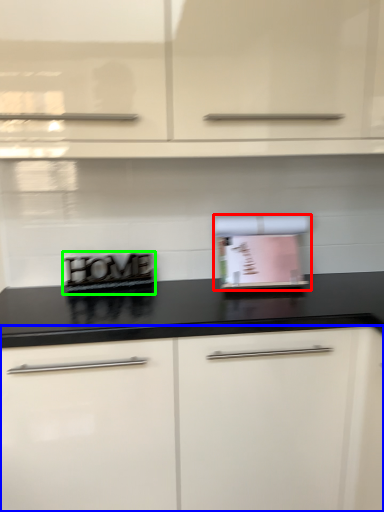
Question: Based on their relative distances, which object is farther from appliance (highlighted by a red box)? Choose from cabinetry (highlighted by a blue box) and appliance (highlighted by a green box).

Choices:
 (A) cabinetry
 (B) appliance

Answer: (A)